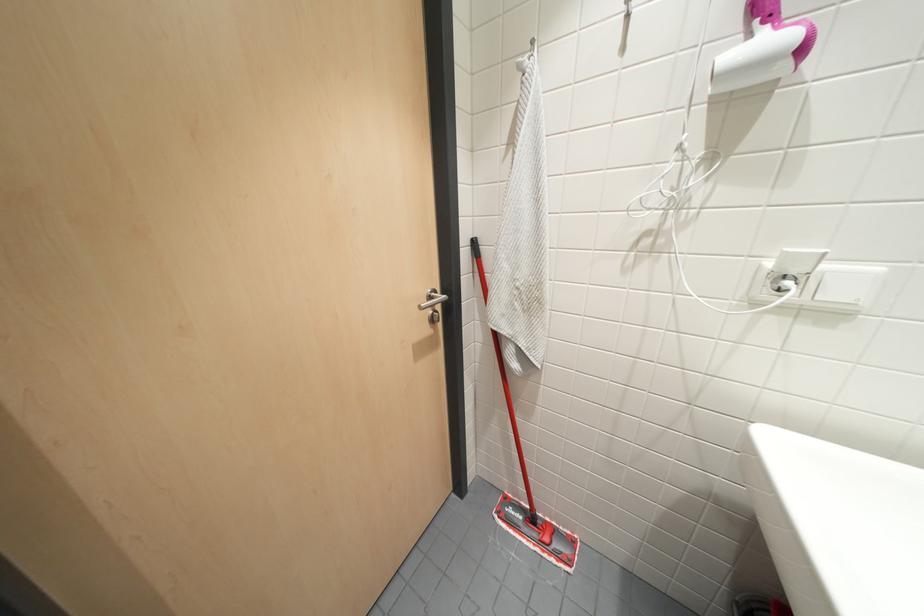
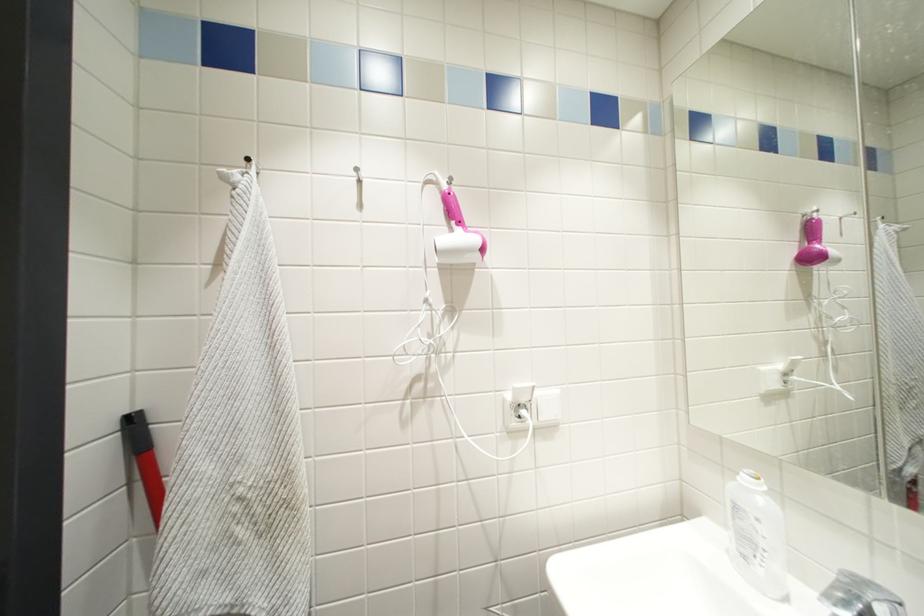
The first image is from the beginning of the video and the second image is from the end. How did the camera likely rotate when shooting the video?

The camera rotated toward right-up.